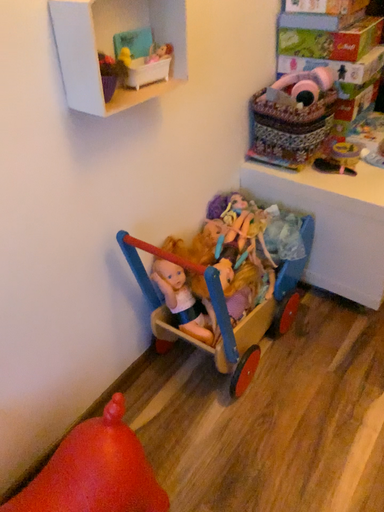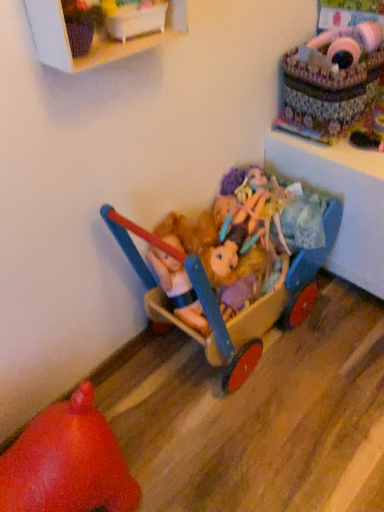
Question: Which way did the camera rotate in the video?

Choices:
 (A) rotated right
 (B) rotated left

Answer: (B)